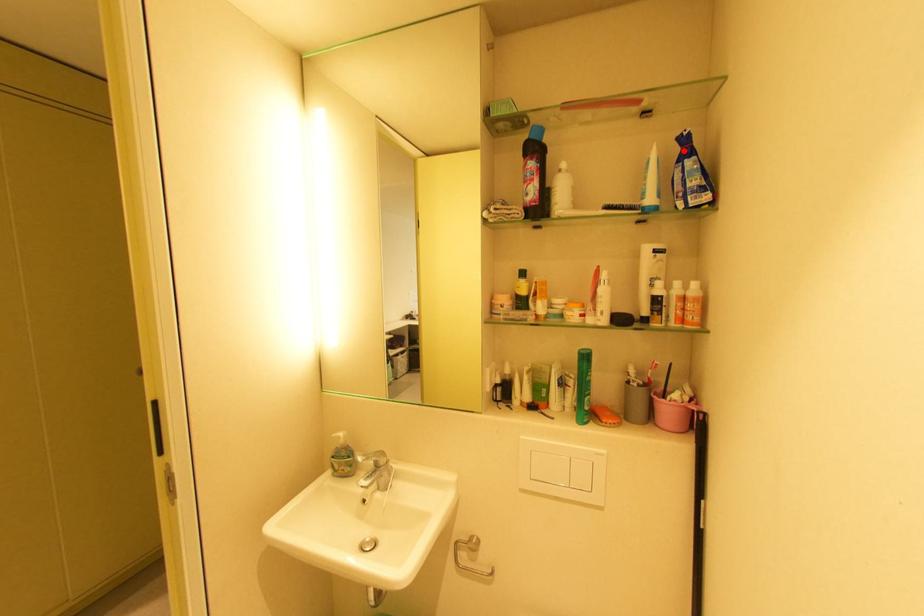
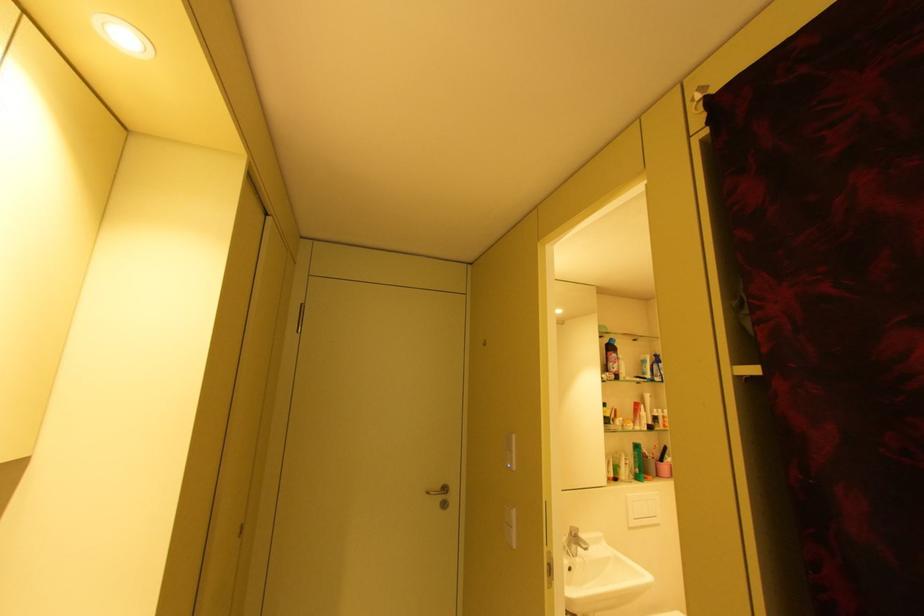
Locate, in the second image, the point that corresponds to the highlighted location in the first image.

(661, 359)